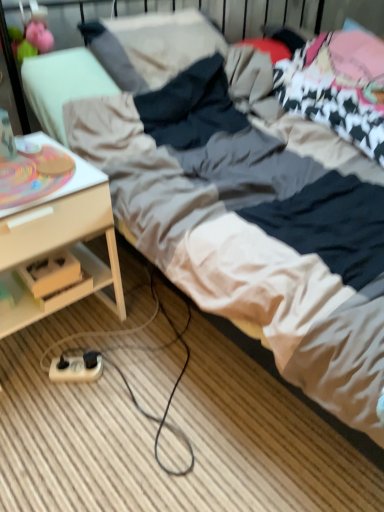
Where is `vacant area situated to the left side of beige plastic extension cord at lower left`? vacant area situated to the left side of beige plastic extension cord at lower left is located at coordinates (30, 370).